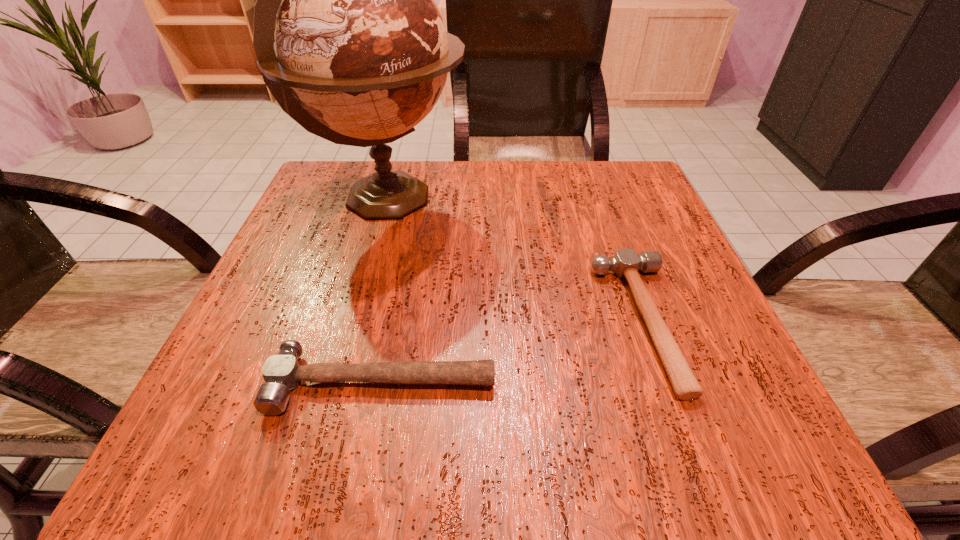
Find the location of a particular element. This screenshot has width=960, height=540. vacant space at the near right corner is located at coordinates (686, 437).

Where is `free space between the left hammer and the rightmost object`? free space between the left hammer and the rightmost object is located at coordinates (512, 352).

Where is `free space between the left hammer and the globe`? The width and height of the screenshot is (960, 540). free space between the left hammer and the globe is located at coordinates (385, 291).

Where is `vacant point located between the rightmost object and the left hammer`? The height and width of the screenshot is (540, 960). vacant point located between the rightmost object and the left hammer is located at coordinates (512, 352).

Image resolution: width=960 pixels, height=540 pixels. Identify the location of free space that is in between the left hammer and the globe. (385, 291).

The height and width of the screenshot is (540, 960). Find the location of `free area in between the rightmost object and the farthest object`. free area in between the rightmost object and the farthest object is located at coordinates (515, 260).

Where is `empty space that is in between the globe and the rightmost object`? empty space that is in between the globe and the rightmost object is located at coordinates (515, 260).

Image resolution: width=960 pixels, height=540 pixels. Identify the location of empty space between the tallest object and the rightmost object. (515, 260).

Where is `vacant area between the left hammer and the farthest object`? vacant area between the left hammer and the farthest object is located at coordinates (385, 291).

I want to click on vacant space in between the right hammer and the left hammer, so click(512, 352).